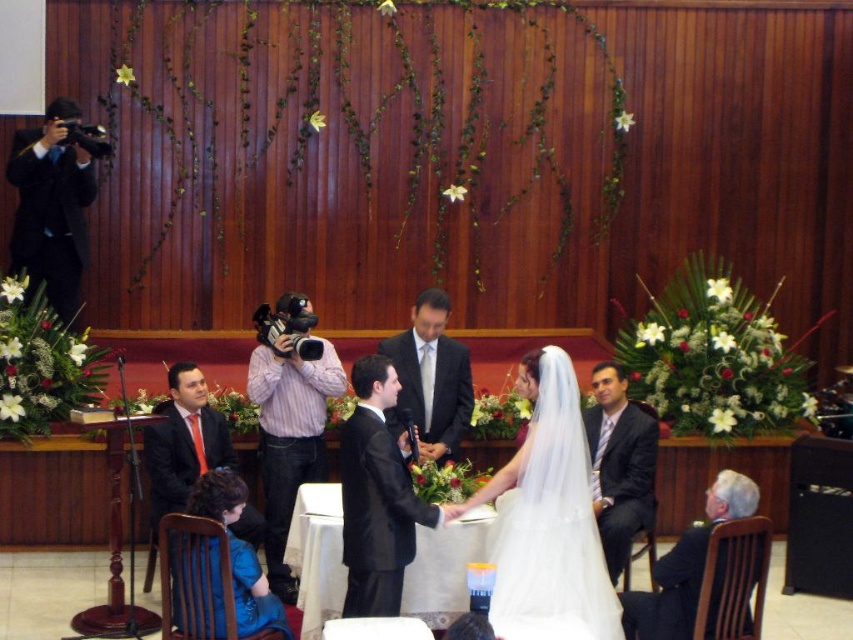
Which is behind, point (503, 604) or point (265, 314)?

Positioned behind is point (265, 314).

Is white sheer veil at center taller than pink striped shirt at center?

No.

Is point (590, 472) in front of point (289, 477)?

Yes, it is.

Locate an element on the screen. This screenshot has width=853, height=640. white sheer veil at center is located at coordinates (548, 518).

Can you confirm if white sheer veil at center is shorter than black suit at left?

Yes.

Which is above, white sheer veil at center or black suit at left?

black suit at left is higher up.

Locate an element on the screen. This screenshot has height=640, width=853. white sheer veil at center is located at coordinates (548, 518).

Is point (331, 484) in front of point (32, 243)?

Yes.

Between white cloth table at center and black suit at left, which one is positioned higher?

black suit at left is higher up.

Find the location of `white cloth table at center`. white cloth table at center is located at coordinates (317, 554).

Identify the location of white cloth table at center. This screenshot has height=640, width=853. (317, 554).